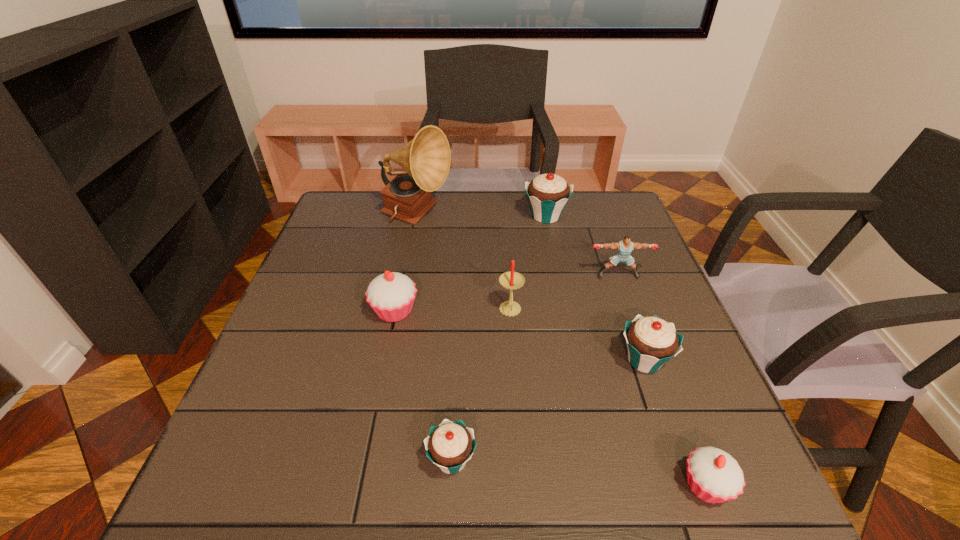
Find the location of a particular element. The height and width of the screenshot is (540, 960). free point between the second biggest teal cupcake and the phonograph record is located at coordinates (531, 289).

Where is `vacant area between the fourth nearest cupcake and the red puncher`? The image size is (960, 540). vacant area between the fourth nearest cupcake and the red puncher is located at coordinates (506, 293).

This screenshot has height=540, width=960. I want to click on vacant space that is in between the leftmost teal cupcake and the farther pink cupcake, so click(x=423, y=386).

Where is `object that stands as the seventh closest to the second cupcake from left to right`? The height and width of the screenshot is (540, 960). object that stands as the seventh closest to the second cupcake from left to right is located at coordinates (548, 194).

What are the coordinates of `object that can be found as the closest to the red puncher` in the screenshot? It's located at (548, 194).

Locate an element on the screen. Image resolution: width=960 pixels, height=540 pixels. cupcake that is the closest one to the smallest teal cupcake is located at coordinates (391, 295).

Locate which cupcake is the second closest to the tallest object. Please provide its 2D coordinates. Your answer should be formatted as a tuple, i.e. [(x, y)], where the tuple contains the x and y coordinates of a point satisfying the conditions above.

[(391, 295)]

Select which teal cupcake appears as the closest to the phonograph record. Please provide its 2D coordinates. Your answer should be formatted as a tuple, i.e. [(x, y)], where the tuple contains the x and y coordinates of a point satisfying the conditions above.

[(548, 194)]

Find the location of `teal cupcake that is the second closest to the smallest teal cupcake`. teal cupcake that is the second closest to the smallest teal cupcake is located at coordinates (548, 194).

Identify the location of free spot that satisfies the following two spatial constraints: 1. on the horn of the tallest object; 2. on the right side of the fourth object from left to right. The height and width of the screenshot is (540, 960). (398, 311).